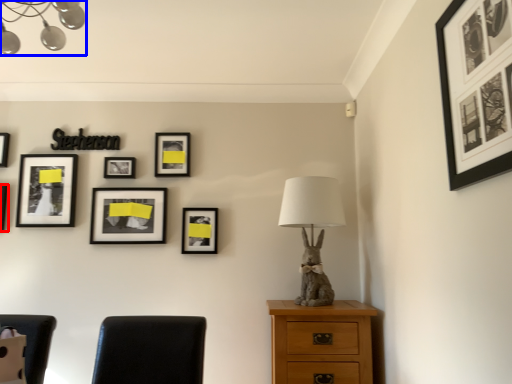
Question: Among these objects, which one is nearest to the camera, picture frame (highlighted by a red box) or lamp (highlighted by a blue box)?

Choices:
 (A) picture frame
 (B) lamp

Answer: (B)